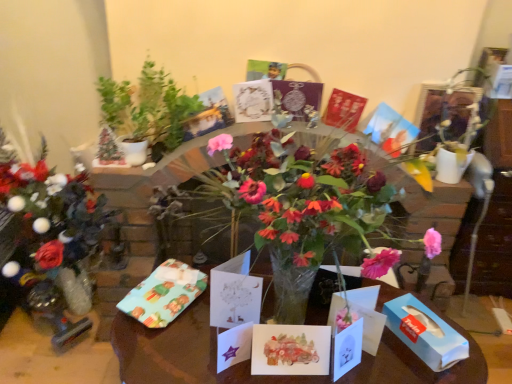
Question: Would you say matte red card at center, the second birthday card when ordered from top to bottom, is outside white paper card at center, positioned as the fifth birthday card in back-to-front order?

Choices:
 (A) yes
 (B) no

Answer: (A)

Question: Is matte red card at center, which is counted as the 1th birthday card, starting from the back, facing away from white paper card at center, positioned as the fifth birthday card in back-to-front order?

Choices:
 (A) no
 (B) yes

Answer: (A)

Question: Can you confirm if matte red card at center, the fifth birthday card viewed from the front, is bigger than white paper card at center, positioned as the 1th birthday card in bottom-to-top order?

Choices:
 (A) yes
 (B) no

Answer: (A)

Question: Does matte red card at center, the second birthday card when ordered from top to bottom, have a smaller size compared to white paper card at center, positioned as the 1th birthday card in bottom-to-top order?

Choices:
 (A) no
 (B) yes

Answer: (A)

Question: Can you confirm if matte red card at center, which is counted as the 1th birthday card, starting from the back, is positioned to the left of white paper card at center, which is the 1th birthday card in front-to-back order?

Choices:
 (A) yes
 (B) no

Answer: (B)

Question: Is watercolor paper card at center, positioned as the second birthday card in front-to-back order, spatially inside green leafy plant at upper left, or outside of it?

Choices:
 (A) outside
 (B) inside

Answer: (A)

Question: In terms of size, does watercolor paper card at center, the 4th birthday card from the top, appear bigger or smaller than green leafy plant at upper left?

Choices:
 (A) big
 (B) small

Answer: (B)

Question: From a real-world perspective, relative to green leafy plant at upper left, is watercolor paper card at center, arranged as the 2th birthday card when ordered from the bottom, vertically above or below?

Choices:
 (A) above
 (B) below

Answer: (B)

Question: Relative to green leafy plant at upper left, is watercolor paper card at center, arranged as the 2th birthday card when ordered from the bottom, in front or behind?

Choices:
 (A) front
 (B) behind

Answer: (A)

Question: Considering the positions of matte paper cards at center and blue paper tissue box at lower right in the image, is matte paper cards at center bigger or smaller than blue paper tissue box at lower right?

Choices:
 (A) small
 (B) big

Answer: (B)

Question: Visually, is matte paper cards at center positioned to the left or to the right of blue paper tissue box at lower right?

Choices:
 (A) right
 (B) left

Answer: (B)

Question: Is matte paper cards at center taller or shorter than blue paper tissue box at lower right?

Choices:
 (A) tall
 (B) short

Answer: (A)

Question: From a real-world perspective, is matte paper cards at center above or below blue paper tissue box at lower right?

Choices:
 (A) below
 (B) above

Answer: (A)

Question: Based on their positions, is white paper card at center, placed as the fifth birthday card when sorted from bottom to top, located to the left or right of matte paper cards at center?

Choices:
 (A) right
 (B) left

Answer: (B)

Question: Is white paper card at center, the third birthday card when ordered from back to front, bigger or smaller than matte paper cards at center?

Choices:
 (A) small
 (B) big

Answer: (A)